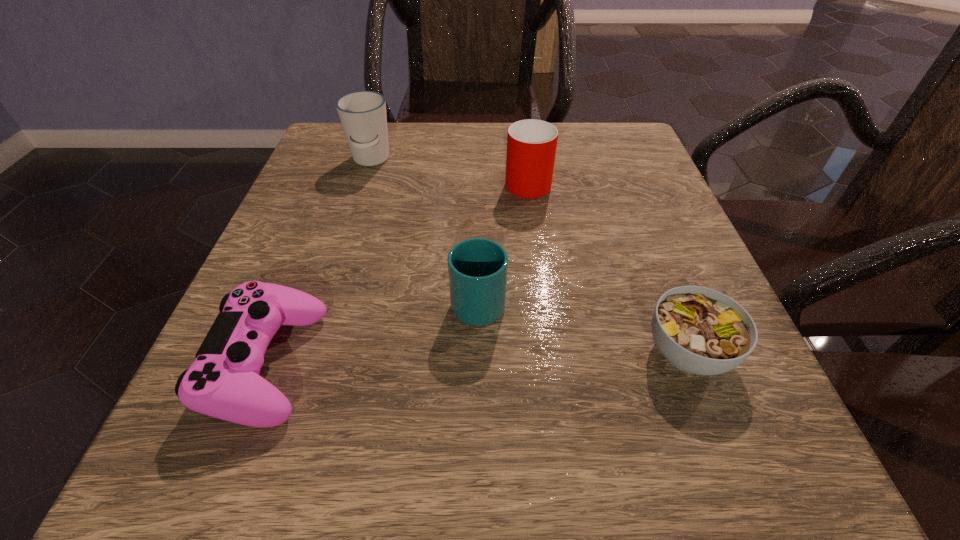
Find the location of `free space located on the handle side of the third shortest object`. free space located on the handle side of the third shortest object is located at coordinates 478,237.

The width and height of the screenshot is (960, 540). In order to click on vacant space located on the right of the control in this screenshot , I will do `click(445, 363)`.

Where is `free point located 0.230m on the back of the soup bowl`? The image size is (960, 540). free point located 0.230m on the back of the soup bowl is located at coordinates coord(636,217).

Where is `object present at the near edge`? The height and width of the screenshot is (540, 960). object present at the near edge is located at coordinates (223, 382).

Locate an element on the screen. This screenshot has height=540, width=960. cup situated at the left edge is located at coordinates (362, 114).

Image resolution: width=960 pixels, height=540 pixels. In order to click on control located in the left edge section of the desktop in this screenshot , I will do [223, 382].

At what (x,y) coordinates should I click in order to perform the action: click on object that is positioned at the right edge. Please return your answer as a coordinate pair (x, y). Looking at the image, I should click on (699, 330).

Where is `object at the far left corner`? This screenshot has height=540, width=960. object at the far left corner is located at coordinates (362, 114).

Find the location of a particular element. object at the near left corner is located at coordinates (223, 382).

I want to click on vacant space at the far edge of the desktop, so click(x=401, y=125).